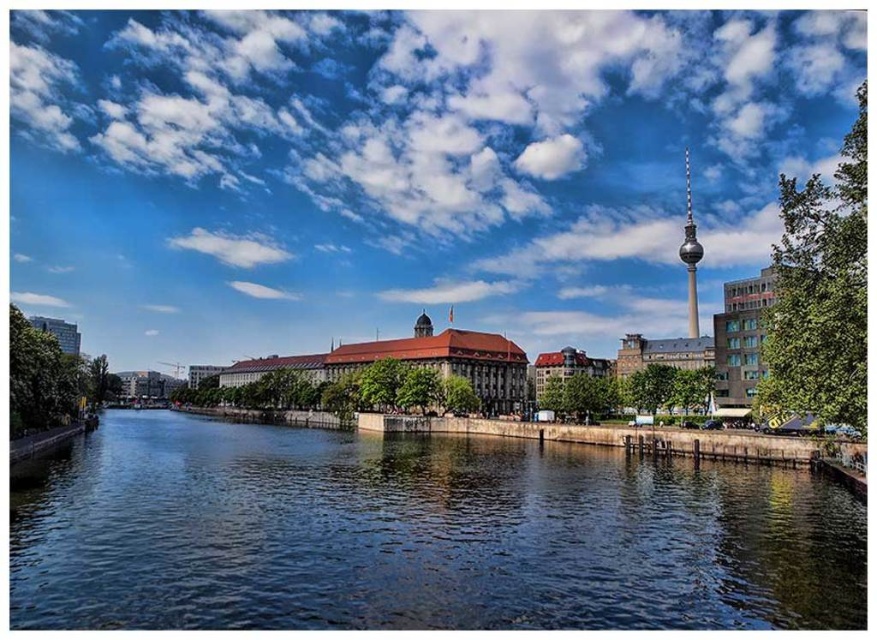
You are a tourist standing on the riverbank and want to take a photo of both the dark blue water at center and the shiny silver tower at upper center. Which object will appear larger in your photo?

The dark blue water at center will appear larger in the photo because it is closer to the viewer than the shiny silver tower at upper center.

You are an architect designing a new bridge that must span the river shown in the image. The bridge needs to accommodate a pathway for pedestrians and a narrow bike lane. Given the scene description and the objects present, can the width of the dark blue water at center support the required bridge design without compromising the structural integrity of the shiny silver tower at upper center?

The dark blue water at center is wider than the shiny silver tower at upper center, so the bridge can be constructed over the water without affecting the tower since the water is wider and the tower is a separate structure on the bank.